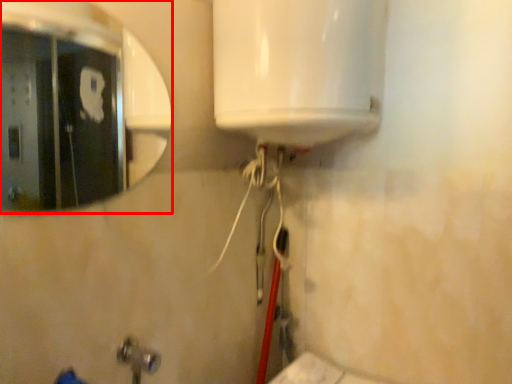
Question: From the image's perspective, what is the correct spatial relationship of mirror (annotated by the red box) in relation to plumbing fixture?

Choices:
 (A) above
 (B) below

Answer: (A)